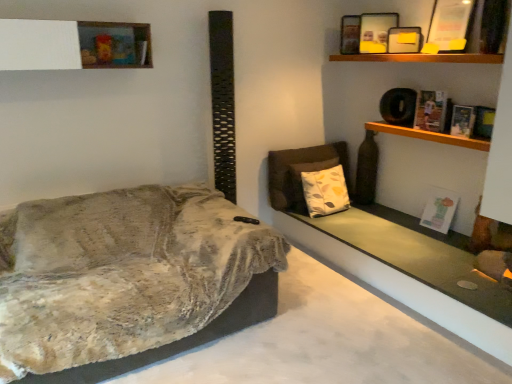
Question: Can you confirm if matte black picture frame at upper right, arranged as the 2th picture frame when viewed from the front, is bigger than wooden shelf at upper right, which is the 1th shelf from right to left?

Choices:
 (A) yes
 (B) no

Answer: (B)

Question: Is matte black picture frame at upper right, placed as the first picture frame when sorted from back to front, behind wooden shelf at upper right, the 2th shelf positioned from the top?

Choices:
 (A) yes
 (B) no

Answer: (A)

Question: Considering the relative sizes of matte black picture frame at upper right, placed as the first picture frame when sorted from back to front, and wooden shelf at upper right, the 2th shelf positioned from the top, in the image provided, is matte black picture frame at upper right, placed as the first picture frame when sorted from back to front, wider than wooden shelf at upper right, the 2th shelf positioned from the top,?

Choices:
 (A) yes
 (B) no

Answer: (B)

Question: From a real-world perspective, is matte black picture frame at upper right, arranged as the 2th picture frame when viewed from the front, located higher than wooden shelf at upper right, the first shelf ordered from the bottom?

Choices:
 (A) yes
 (B) no

Answer: (A)

Question: Is matte black picture frame at upper right, arranged as the 2th picture frame when viewed from the front, at the left side of wooden shelf at upper right, the 2th shelf positioned from the top?

Choices:
 (A) yes
 (B) no

Answer: (A)

Question: Can you confirm if matte black picture frame at upper right, placed as the first picture frame when sorted from back to front, is smaller than wooden shelf at upper right, which is the 1th shelf from right to left?

Choices:
 (A) no
 (B) yes

Answer: (B)

Question: From the image's perspective, is velvet beige couch at left above hardcover book at upper right, the 2th book positioned from the top?

Choices:
 (A) no
 (B) yes

Answer: (A)

Question: Is velvet beige couch at left smaller than hardcover book at upper right, the 2th book positioned from the top?

Choices:
 (A) no
 (B) yes

Answer: (A)

Question: From the image's perspective, is velvet beige couch at left located beneath hardcover book at upper right, marked as the 3th book in a bottom-to-top arrangement?

Choices:
 (A) no
 (B) yes

Answer: (B)

Question: Is hardcover book at upper right, marked as the 3th book in a bottom-to-top arrangement, a part of velvet beige couch at left?

Choices:
 (A) yes
 (B) no

Answer: (B)

Question: Does velvet beige couch at left appear on the right side of hardcover book at upper right, the 2th book positioned from the top?

Choices:
 (A) no
 (B) yes

Answer: (A)

Question: Considering the relative positions of velvet beige couch at left and hardcover book at upper right, marked as the 3th book in a bottom-to-top arrangement, in the image provided, is velvet beige couch at left behind hardcover book at upper right, marked as the 3th book in a bottom-to-top arrangement,?

Choices:
 (A) no
 (B) yes

Answer: (A)

Question: Can you confirm if white matte shelf at upper left, marked as the 2th shelf in a right-to-left arrangement, is wider than wooden shelf at upper right, which is the 1th shelf from right to left?

Choices:
 (A) no
 (B) yes

Answer: (B)